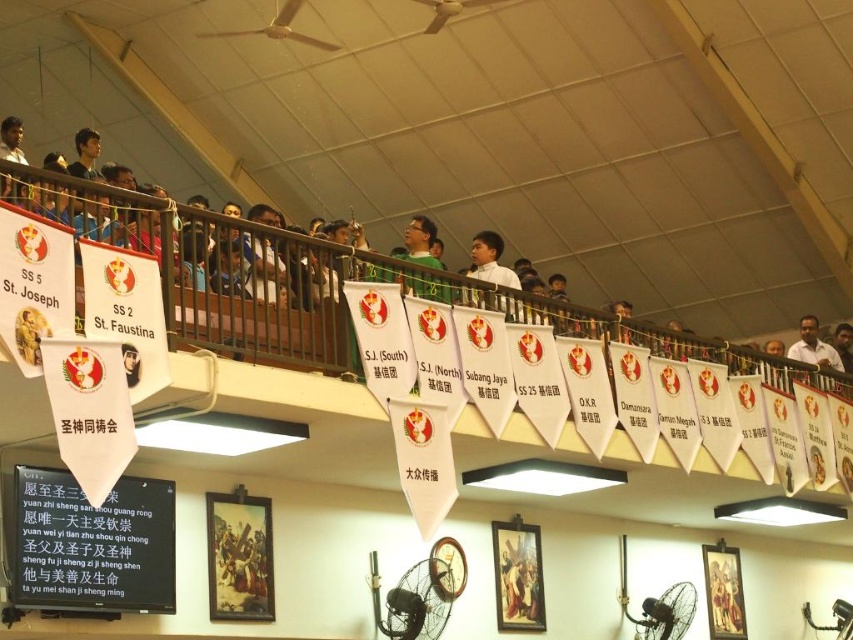
You are standing on the balcony in the image and want to take a photo of both the white matte shirt at upper center and the dark skin man at upper right. Which one should you frame first in your camera viewfinder to ensure both are in the shot?

You should frame the white matte shirt at upper center first since it is to the left of the dark skin man at upper right, allowing you to adjust the camera angle to include both in the shot.

You are standing in the auditorium and want to move from the point at coordinates point [136,241] to the point at coordinates point [822,352]. Based on the scene description, which direction should you move to get closer to your destination?

You should move backward because point [136,241] is in front of point [822,352], meaning the destination is behind the starting point.

You are a stage director planning to place a 10 meter long spotlight beam between the white paper banner at upper center and the white matte shirt at upper center. Based on the scene description, will the spotlight beam fit between them?

The distance between the white paper banner at upper center and the white matte shirt at upper center is 9.76 meters. Since the spotlight beam is 10 meters long, it will not fit between them as it is slightly longer than the available space.